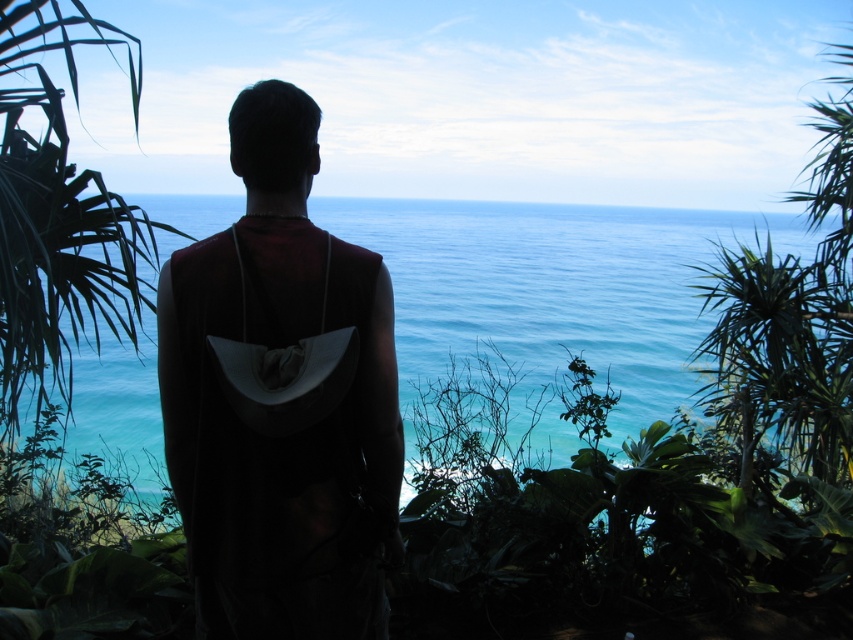
Question: Among these points, which one is nearest to the camera?

Choices:
 (A) (634, 273)
 (B) (281, 497)

Answer: (B)

Question: Which point appears closest to the camera in this image?

Choices:
 (A) (277, 460)
 (B) (538, 234)

Answer: (A)

Question: Among these points, which one is farthest from the camera?

Choices:
 (A) (556, 252)
 (B) (334, 620)

Answer: (A)

Question: Is dark fabric backpack at center below blue water at center?

Choices:
 (A) no
 (B) yes

Answer: (B)

Question: Can you confirm if dark fabric backpack at center is bigger than blue water at center?

Choices:
 (A) no
 (B) yes

Answer: (A)

Question: Where is dark fabric backpack at center located in relation to blue water at center in the image?

Choices:
 (A) left
 (B) right

Answer: (A)